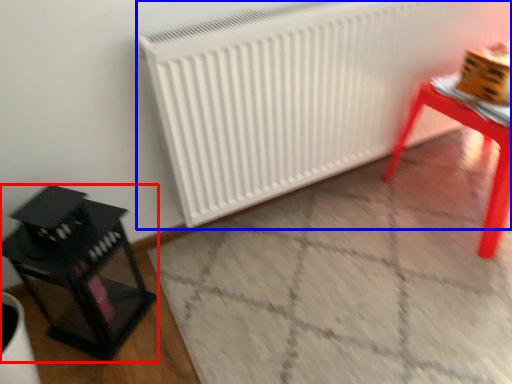
Question: Among these objects, which one is nearest to the camera, furniture (highlighted by a red box) or radiator (highlighted by a blue box)?

Choices:
 (A) furniture
 (B) radiator

Answer: (A)